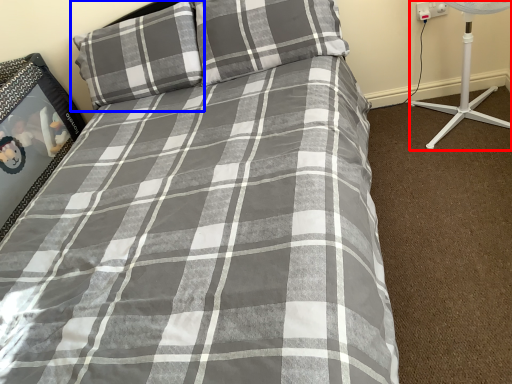
Question: Which object appears farthest to the camera in this image, fan (highlighted by a red box) or pillow (highlighted by a blue box)?

Choices:
 (A) fan
 (B) pillow

Answer: (B)